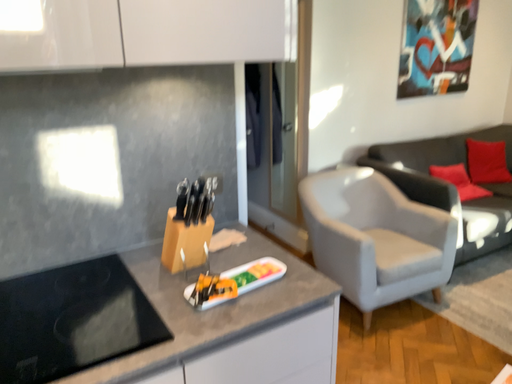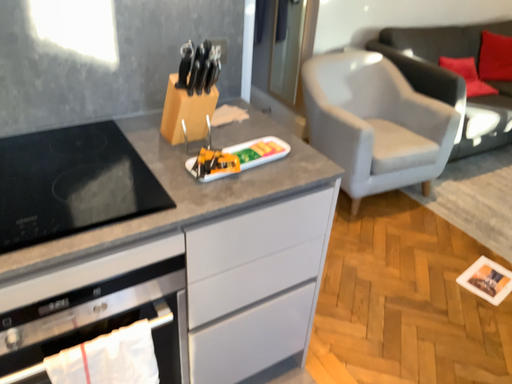
Question: Which way did the camera rotate in the video?

Choices:
 (A) rotated upward
 (B) rotated downward

Answer: (B)